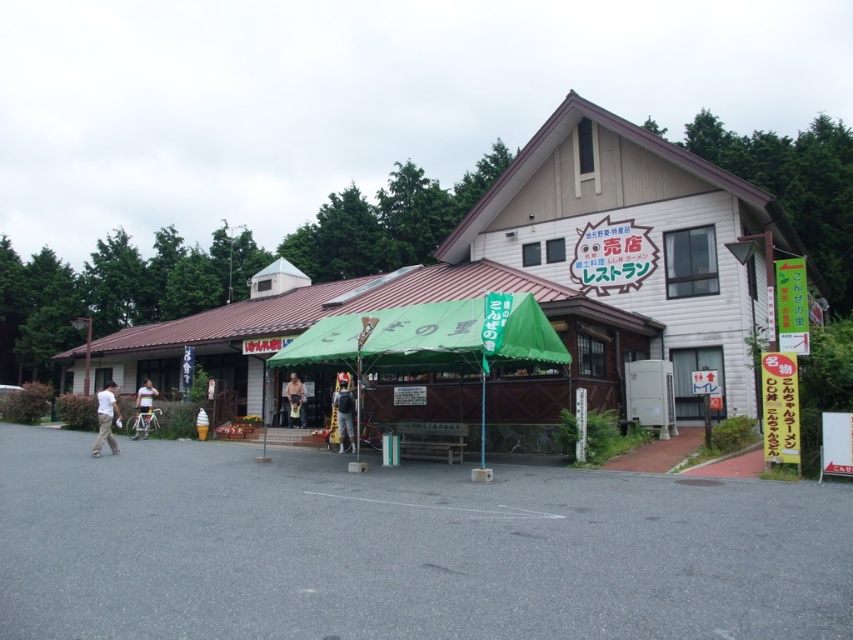
You are a customer looking for a shaded spot to sit. You see a wooden tent at center and a green fabric canopy at center. Which one is more to the left?

The wooden tent at center is positioned on the left side of green fabric canopy at center, so it is more to the left.

You are standing at the entrance of the two story building and want to walk towards the green canopy. There are two points marked on the ground, point 1 at coordinates point (x=347, y=422) and point 2 at coordinates point (x=297, y=426). Which point is closer to the building?

Point (x=347, y=422) is in front of point (x=297, y=426), so point (x=297, y=426) is closer to the building.

You are a customer looking for a place to sit under the canopy. You see a denim jacket at center and a light brown wooden bench at center. Which object is shorter and therefore more suitable for sitting?

The denim jacket at center is shorter than the light brown wooden bench at center, so it is more suitable for sitting.